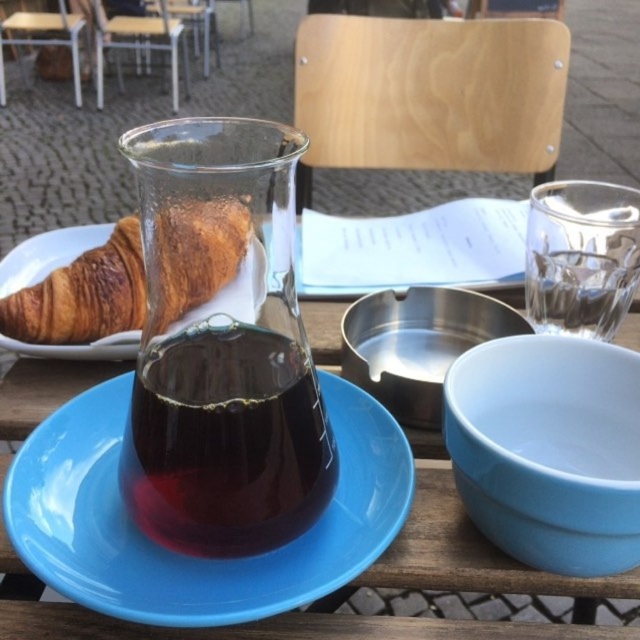
You are a customer at the outdoor cafe and want to place your phone between the dark glass carafe at center and the shiny metallic bowl at center. Based on their positions, which object should you move to make space?

The dark glass carafe at center is to the left of the shiny metallic bowl at center. To create space between them, you would need to move the dark glass carafe at center to the left or the shiny metallic bowl at center to the right.

You are a customer at the outdoor cafe and want to grab the transparent glass carafe at center and the shiny metallic bowl at center. Which one do you need to reach further to get?

The shiny metallic bowl at center is further away from you than the transparent glass carafe at center, so you need to reach further to get the shiny metallic bowl at center.